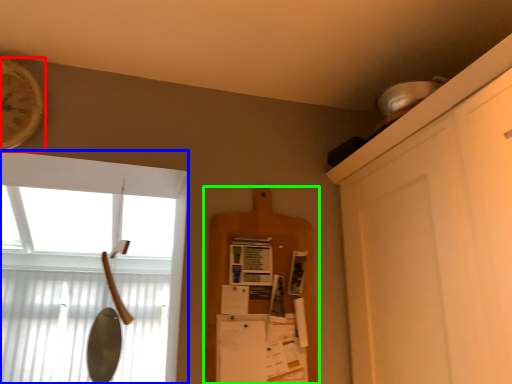
Question: Considering the real-world distances, which object is closest to clock (highlighted by a red box)? window (highlighted by a blue box) or shelf (highlighted by a green box).

Choices:
 (A) window
 (B) shelf

Answer: (B)